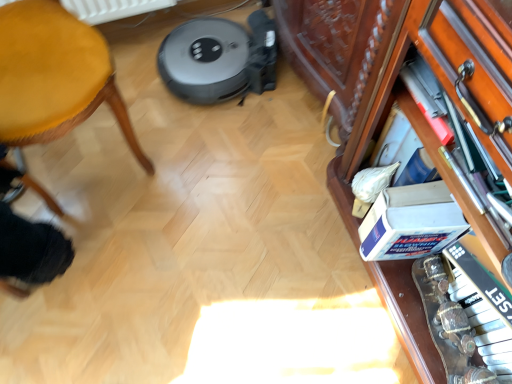
In order to face yellow fabric stool at left, should I rotate leftwards or rightwards?

To align with it, rotate left about 27.292°.

Looking at this image, measure the distance between point (493,342) and camera.

The distance of point (493,342) from camera is 92.30 centimeters.

What are the coordinates of `yellow fabric stool at left` in the screenshot? It's located at (54, 76).

From the image's perspective, which one is positioned lower, white cardboard box at lower right or wooden piano keys at right?

From the image's view, white cardboard box at lower right is below.

Is white cardboard box at lower right smaller than wooden piano keys at right?

Yes.

Would you say white cardboard box at lower right is inside or outside wooden piano keys at right?

white cardboard box at lower right can be found inside wooden piano keys at right.

Does wooden drawer at right appear on the right side of yellow fabric stool at left?

Yes.

Is point (499, 87) farther from viewer compared to point (87, 99)?

No, (499, 87) is closer to viewer.

Is yellow fabric stool at left bigger than wooden drawer at right?

Correct, yellow fabric stool at left is larger in size than wooden drawer at right.

From a real-world perspective, is yellow fabric stool at left physically located above or below wooden drawer at right?

In terms of real-world spatial position, yellow fabric stool at left is below wooden drawer at right.

In the scene shown: Between yellow fabric stool at left and wooden drawer at right, which one is positioned in front?

yellow fabric stool at left.

Is yellow fabric stool at left taller than wooden drawer at right?

Yes, yellow fabric stool at left is taller than wooden drawer at right.

Would you say wooden piano keys at right is inside or outside yellow fabric stool at left?

wooden piano keys at right exists outside the volume of yellow fabric stool at left.

Can you confirm if wooden piano keys at right is positioned to the right of yellow fabric stool at left?

Correct, you'll find wooden piano keys at right to the right of yellow fabric stool at left.

Which object is further away from the camera taking this photo, wooden piano keys at right or yellow fabric stool at left?

Positioned behind is wooden piano keys at right.

Can you confirm if white cardboard box at lower right is shorter than yellow fabric stool at left?

Indeed, white cardboard box at lower right has a lesser height compared to yellow fabric stool at left.

Is white cardboard box at lower right turned away from yellow fabric stool at left?

No.

Image resolution: width=512 pixels, height=384 pixels. What are the coordinates of `box that appears below the yellow fabric stool at left (from the image's perspective)` in the screenshot? It's located at (411, 222).

Is yellow fabric stool at left to the right of white cardboard box at lower right from the viewer's perspective?

Incorrect, yellow fabric stool at left is not on the right side of white cardboard box at lower right.

Between yellow fabric stool at left and white cardboard box at lower right, which one is positioned behind?

Positioned behind is white cardboard box at lower right.

Is there a large distance between yellow fabric stool at left and white cardboard box at lower right?

No, yellow fabric stool at left is in close proximity to white cardboard box at lower right.

Identify the location of furniture that is above the white cardboard box at lower right (from the image's perspective). The width and height of the screenshot is (512, 384). (54, 76).

Is wooden drawer at right thinner than wooden piano keys at right?

Correct, the width of wooden drawer at right is less than that of wooden piano keys at right.

This screenshot has height=384, width=512. In the image, there is a wooden piano keys at right. Find the location of `drawer above it (from the image's perspective)`. drawer above it (from the image's perspective) is located at coordinates (470, 74).

From the image's perspective, is wooden drawer at right positioned above or below wooden piano keys at right?

Clearly, from the image's perspective, wooden drawer at right is above wooden piano keys at right.

You are a GUI agent. You are given a task and a screenshot of the screen. Output one action in this format:
    pyautogui.click(x=<x>, y=<y>)
    Task: Click on the shelf that appears on the right of white cardboard box at lower right
    This screenshot has width=512, height=384.
    Given the screenshot: What is the action you would take?
    pyautogui.click(x=444, y=192)

Locate an element on the screen. This screenshot has width=512, height=384. furniture on the left of wooden drawer at right is located at coordinates (54, 76).

From the image, which object appears to be farther from wooden drawer at right, wooden piano keys at right or yellow fabric stool at left?

yellow fabric stool at left is further to wooden drawer at right.

Looking at the image, which one is located closer to white cardboard box at lower right, wooden piano keys at right or yellow fabric stool at left?

The object closer to white cardboard box at lower right is wooden piano keys at right.

Which object lies nearer to the anchor point yellow fabric stool at left, wooden piano keys at right or white cardboard box at lower right?

wooden piano keys at right is positioned closer to the anchor yellow fabric stool at left.

From the image, which object appears to be farther from white cardboard box at lower right, yellow fabric stool at left or wooden drawer at right?

Based on the image, yellow fabric stool at left appears to be further to white cardboard box at lower right.

Looking at the image, which one is located closer to yellow fabric stool at left, wooden drawer at right or white cardboard box at lower right?

wooden drawer at right lies closer to yellow fabric stool at left than the other object.

When comparing their distances from wooden drawer at right, does white cardboard box at lower right or wooden piano keys at right seem closer?

wooden piano keys at right is positioned closer to the anchor wooden drawer at right.

When comparing their distances from wooden piano keys at right, does white cardboard box at lower right or wooden drawer at right seem further?

wooden drawer at right.

When comparing their distances from yellow fabric stool at left, does white cardboard box at lower right or wooden piano keys at right seem further?

white cardboard box at lower right lies further to yellow fabric stool at left than the other object.

The width and height of the screenshot is (512, 384). Find the location of `drawer located between yellow fabric stool at left and wooden piano keys at right in the left-right direction`. drawer located between yellow fabric stool at left and wooden piano keys at right in the left-right direction is located at coordinates tap(470, 74).

This screenshot has width=512, height=384. In order to click on box between yellow fabric stool at left and wooden drawer at right in the horizontal direction in this screenshot , I will do `click(411, 222)`.

The image size is (512, 384). I want to click on shelf between wooden drawer at right and white cardboard box at lower right from front to back, so click(x=444, y=192).

Where is `box between yellow fabric stool at left and wooden piano keys at right in the horizontal direction`? box between yellow fabric stool at left and wooden piano keys at right in the horizontal direction is located at coordinates (411, 222).